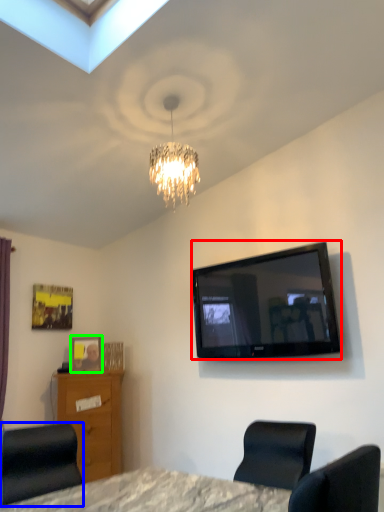
Question: Which object is the closest to the television (highlighted by a red box)? Choose among these: chair (highlighted by a blue box) or picture frame (highlighted by a green box).

Choices:
 (A) chair
 (B) picture frame

Answer: (B)